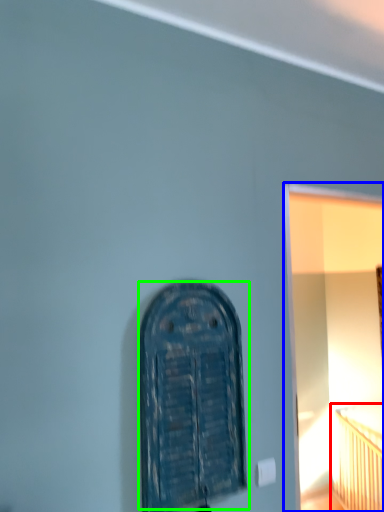
Question: Estimate the real-world distances between objects in this image. Which object is closer to bed (highlighted by a red box), window frame (highlighted by a blue box) or door (highlighted by a green box)?

Choices:
 (A) window frame
 (B) door

Answer: (A)